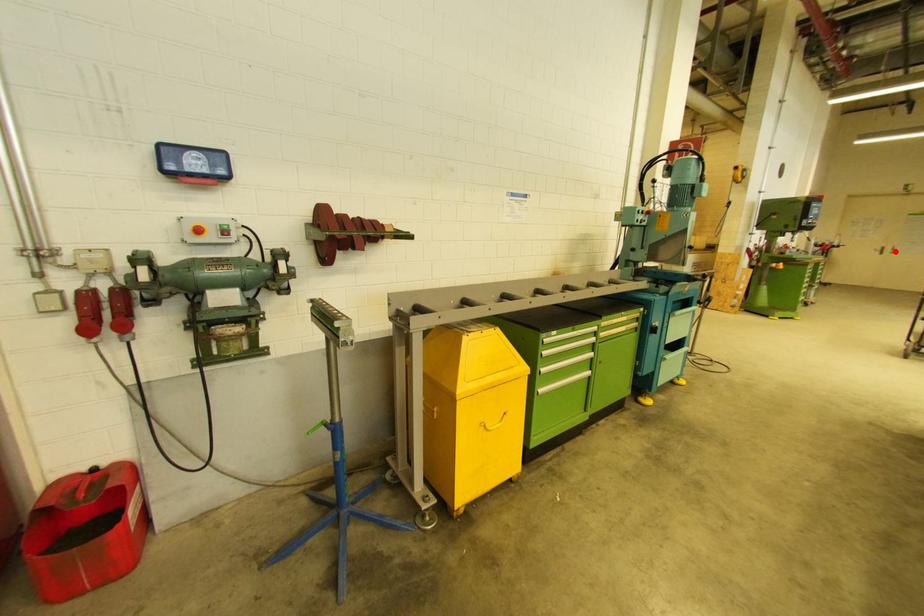
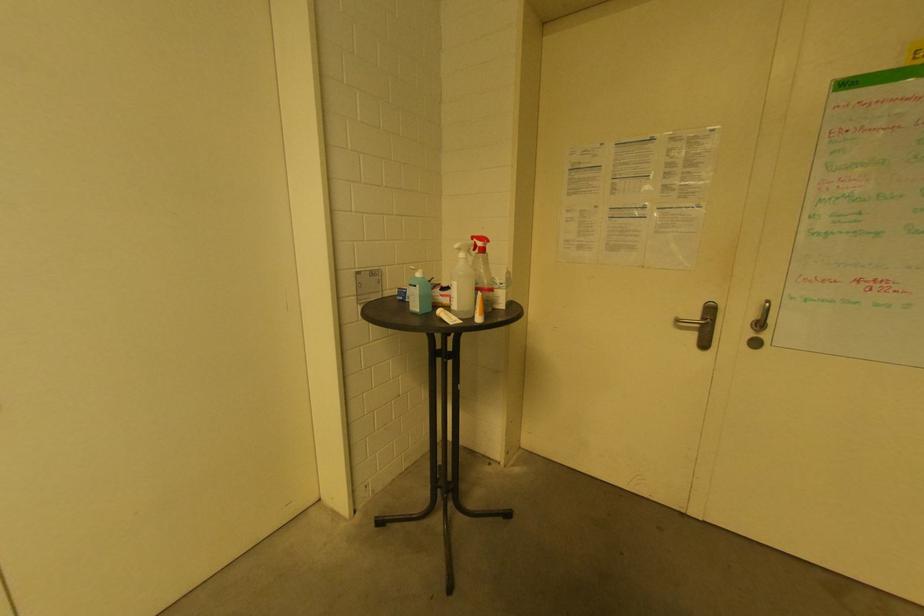
Question: I am providing you with two images of the same scene from different viewpoints. Given a red point in image1, look at the same physical point in image2. Is it:

Choices:
 (A) Closer to the viewpoint
 (B) Farther from the viewpoint

Answer: (A)